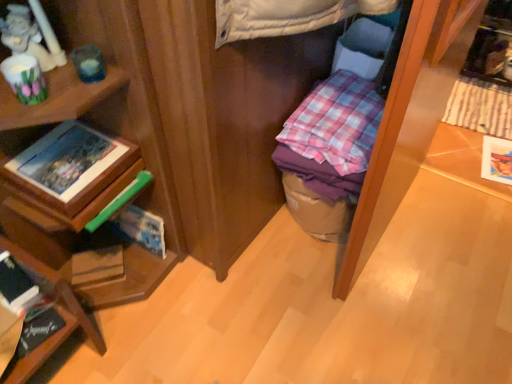
This screenshot has height=384, width=512. What are the coordinates of `free spot in front of hardcover book at left, positioned as the 2th paperback book in top-to-bottom order` in the screenshot? It's located at (140, 302).